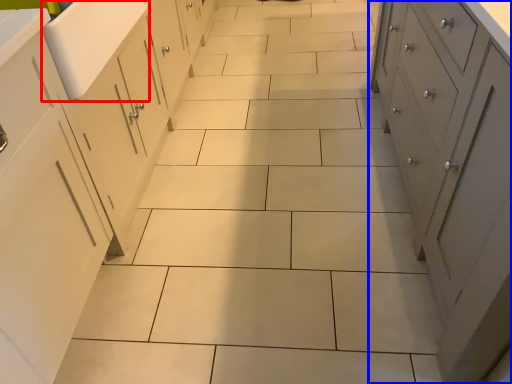
Question: Which point is closer to the camera, sink (highlighted by a red box) or cupboard (highlighted by a blue box)?

Choices:
 (A) sink
 (B) cupboard

Answer: (B)